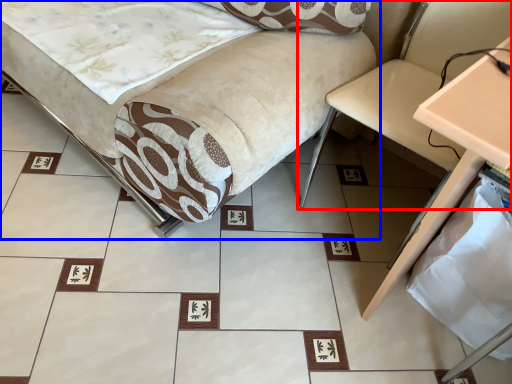
Question: Which point is closer to the camera, swivel chair (highlighted by a red box) or furniture (highlighted by a blue box)?

Choices:
 (A) swivel chair
 (B) furniture

Answer: (B)